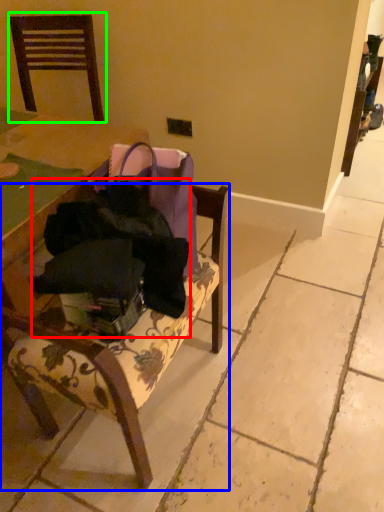
Question: Which is farther away from clothing (highlighted by a red box)? chair (highlighted by a blue box) or chair (highlighted by a green box)?

Choices:
 (A) chair
 (B) chair

Answer: (B)